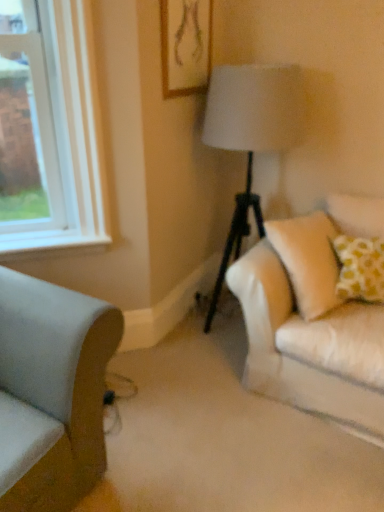
Question: Is light gray fabric couch at lower left facing away from wooden framed artwork at upper center?

Choices:
 (A) yes
 (B) no

Answer: (B)

Question: From a real-world perspective, is light gray fabric couch at lower left below wooden framed artwork at upper center?

Choices:
 (A) yes
 (B) no

Answer: (A)

Question: From a real-world perspective, is light gray fabric couch at lower left over wooden framed artwork at upper center?

Choices:
 (A) no
 (B) yes

Answer: (A)

Question: Does light gray fabric couch at lower left have a lesser height compared to wooden framed artwork at upper center?

Choices:
 (A) no
 (B) yes

Answer: (A)

Question: Is wooden framed artwork at upper center located within light gray fabric couch at lower left?

Choices:
 (A) yes
 (B) no

Answer: (B)

Question: Is light gray fabric couch at lower left smaller than wooden framed artwork at upper center?

Choices:
 (A) no
 (B) yes

Answer: (A)

Question: Is wooden framed artwork at upper center facing towards white smooth window sill at left?

Choices:
 (A) no
 (B) yes

Answer: (A)

Question: Can you confirm if wooden framed artwork at upper center is positioned to the left of white smooth window sill at left?

Choices:
 (A) yes
 (B) no

Answer: (B)

Question: Would you consider wooden framed artwork at upper center to be distant from white smooth window sill at left?

Choices:
 (A) no
 (B) yes

Answer: (A)

Question: Considering the relative sizes of wooden framed artwork at upper center and white smooth window sill at left in the image provided, is wooden framed artwork at upper center bigger than white smooth window sill at left?

Choices:
 (A) no
 (B) yes

Answer: (B)

Question: Can you confirm if wooden framed artwork at upper center is thinner than white smooth window sill at left?

Choices:
 (A) yes
 (B) no

Answer: (A)

Question: Is wooden framed artwork at upper center oriented away from white smooth window sill at left?

Choices:
 (A) yes
 (B) no

Answer: (B)

Question: From a real-world perspective, is wooden framed artwork at upper center on light gray fabric couch at lower left?

Choices:
 (A) yes
 (B) no

Answer: (A)